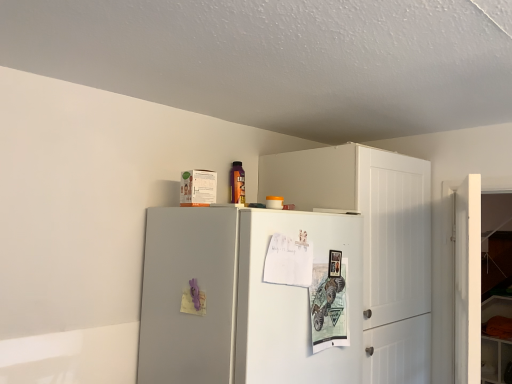
Question: Considering their positions, is satin gray refrigerator at upper center located in front of or behind white matte door at right?

Choices:
 (A) behind
 (B) front

Answer: (B)

Question: From a real-world perspective, is satin gray refrigerator at upper center positioned above or below white matte door at right?

Choices:
 (A) above
 (B) below

Answer: (B)

Question: Estimate the real-world distances between objects in this image. Which object is farther from the white matte door at right?

Choices:
 (A) white matte cabinet at upper right
 (B) satin gray refrigerator at upper center

Answer: (B)

Question: Which object is the farthest from the satin gray refrigerator at upper center?

Choices:
 (A) white matte cabinet at upper right
 (B) white matte door at right

Answer: (B)